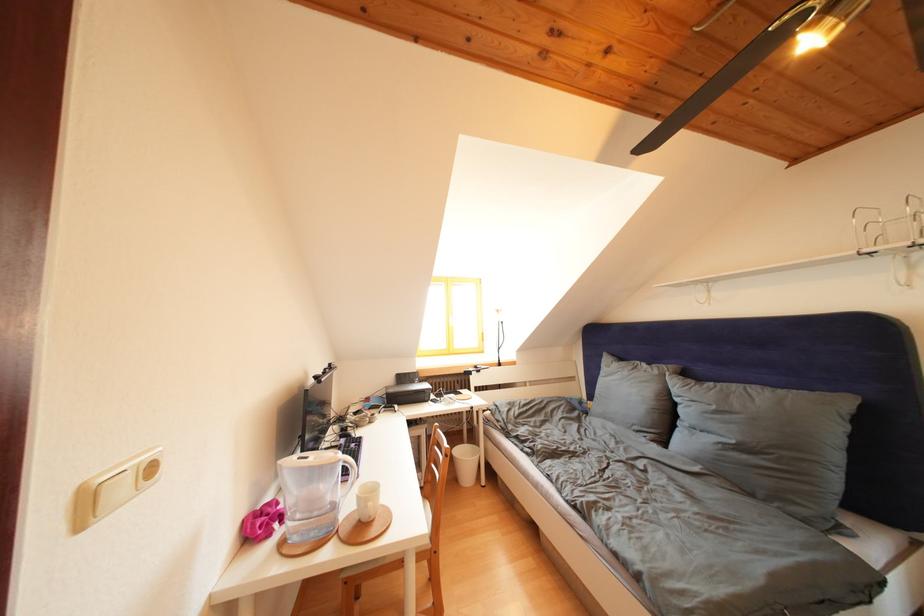
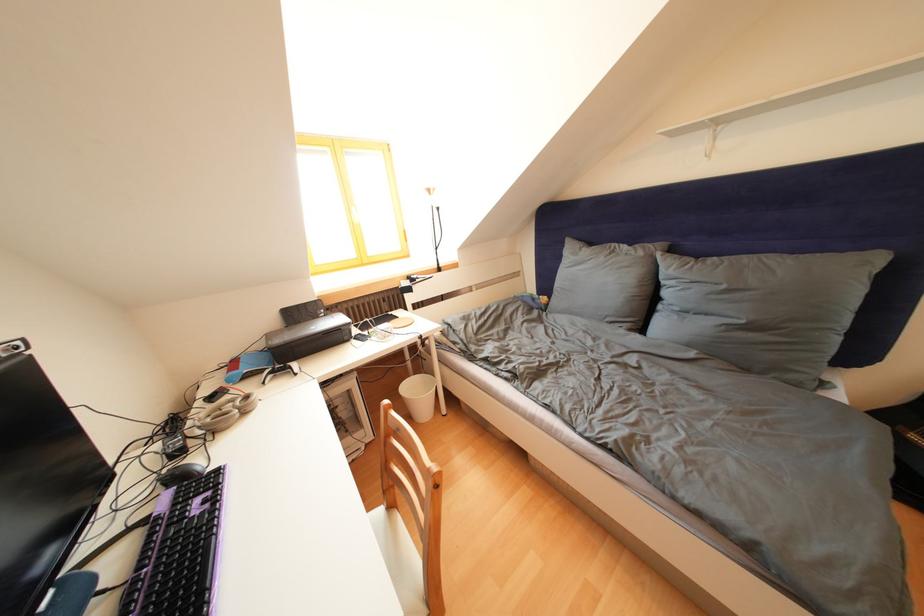
How did the camera likely rotate?

The camera rotated toward right-down.